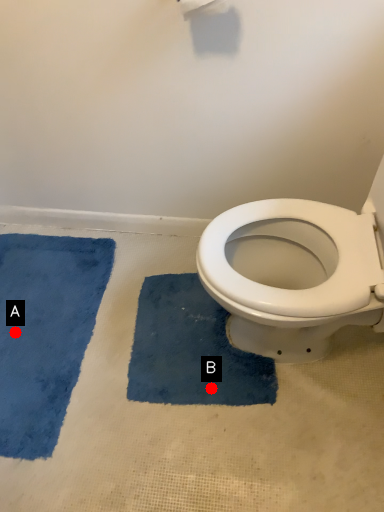
Question: Two points are circled on the image, labeled by A and B beside each circle. Which point is farther to the camera?

Choices:
 (A) A is further
 (B) B is further

Answer: (A)